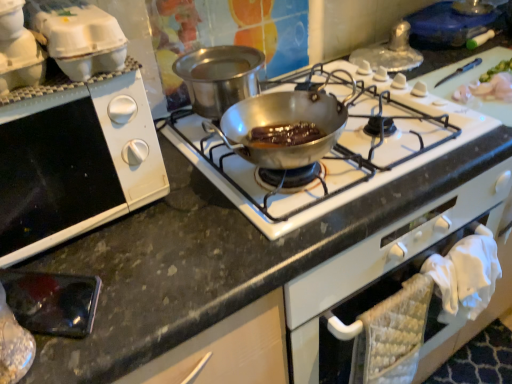
Question: Is stainless steel pan at center bigger than white cardboard egg carton at upper left?

Choices:
 (A) yes
 (B) no

Answer: (A)

Question: Can we say stainless steel pan at center lies outside white cardboard egg carton at upper left?

Choices:
 (A) no
 (B) yes

Answer: (B)

Question: From the image's perspective, does stainless steel pan at center appear lower than white cardboard egg carton at upper left?

Choices:
 (A) yes
 (B) no

Answer: (B)

Question: Is stainless steel pan at center aimed at white cardboard egg carton at upper left?

Choices:
 (A) yes
 (B) no

Answer: (B)

Question: Does stainless steel pan at center have a smaller size compared to white cardboard egg carton at upper left?

Choices:
 (A) yes
 (B) no

Answer: (B)

Question: Considering the positions of point (212, 74) and point (20, 11), is point (212, 74) closer or farther from the camera than point (20, 11)?

Choices:
 (A) closer
 (B) farther

Answer: (B)

Question: From the image's perspective, is stainless steel pan at center above or below white plastic egg carton at upper left?

Choices:
 (A) below
 (B) above

Answer: (B)

Question: Is stainless steel pan at center taller or shorter than white plastic egg carton at upper left?

Choices:
 (A) short
 (B) tall

Answer: (B)

Question: Is stainless steel pan at center bigger or smaller than white plastic egg carton at upper left?

Choices:
 (A) small
 (B) big

Answer: (B)

Question: From the image's perspective, is shiny silver pan at center positioned above or below white matte oven at left?

Choices:
 (A) above
 (B) below

Answer: (A)

Question: In the image, is shiny silver pan at center positioned in front of or behind white matte oven at left?

Choices:
 (A) front
 (B) behind

Answer: (B)

Question: From a real-world perspective, is shiny silver pan at center positioned above or below white matte oven at left?

Choices:
 (A) below
 (B) above

Answer: (A)

Question: Do you think shiny silver pan at center is within white matte oven at left, or outside of it?

Choices:
 (A) outside
 (B) inside

Answer: (A)

Question: Looking at the image, does white matte oven at left seem bigger or smaller compared to stainless steel pan at center?

Choices:
 (A) big
 (B) small

Answer: (A)

Question: From the image's perspective, is white matte oven at left located above or below stainless steel pan at center?

Choices:
 (A) below
 (B) above

Answer: (A)